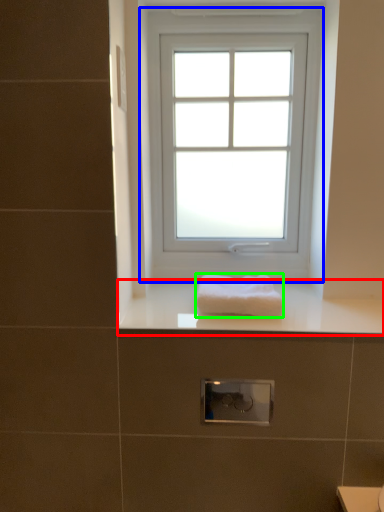
Question: Which is farther away from counter top (highlighted by a red box)? window (highlighted by a blue box) or towel (highlighted by a green box)?

Choices:
 (A) window
 (B) towel

Answer: (A)